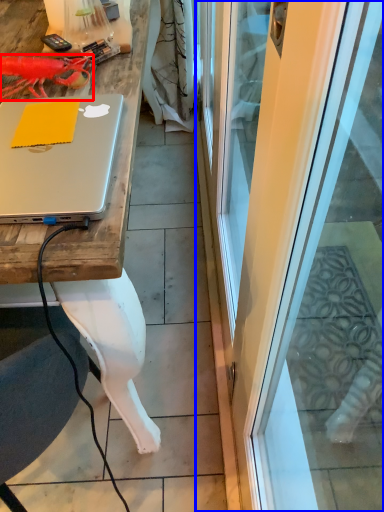
Question: Which object appears closest to the camera in this image, lobster (highlighted by a red box) or screen door (highlighted by a blue box)?

Choices:
 (A) lobster
 (B) screen door

Answer: (B)